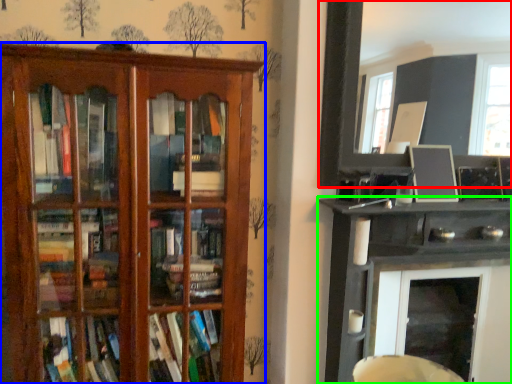
Question: Which object is positioned closest to picture frame (highlighted by a red box)? Select from shelf (highlighted by a blue box) and shelf (highlighted by a green box).

Choices:
 (A) shelf
 (B) shelf

Answer: (B)